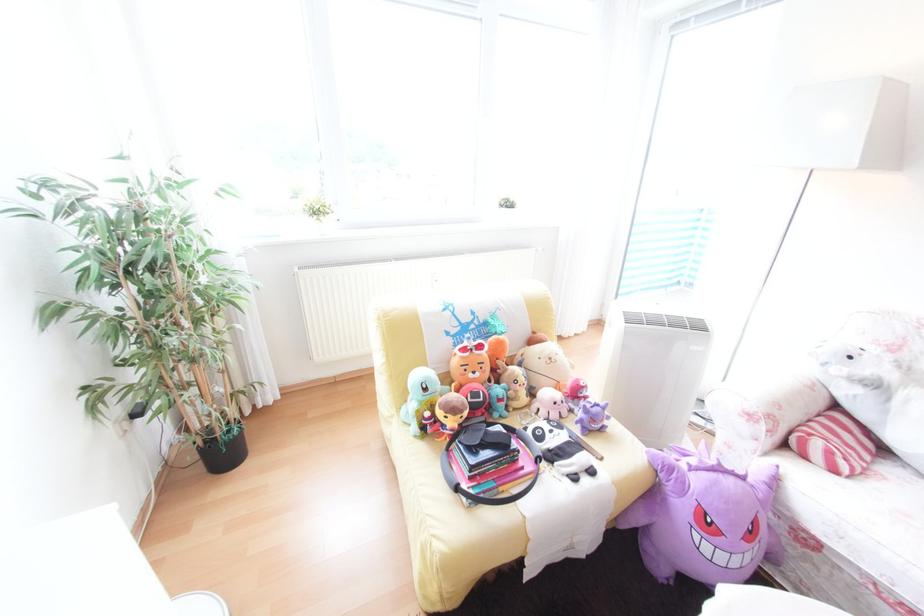
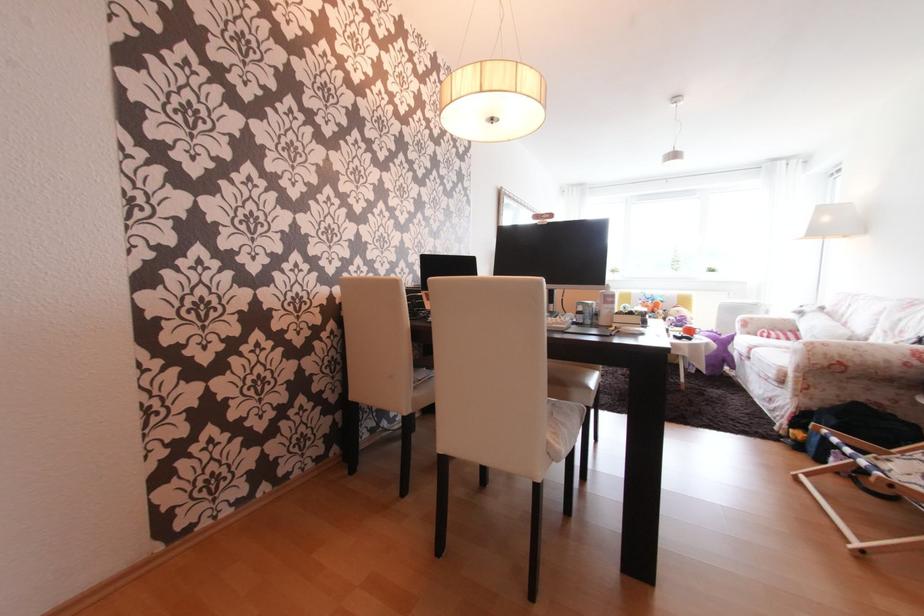
Locate, in the second image, the point that corresponds to pixel 751 479 in the first image.

(727, 336)